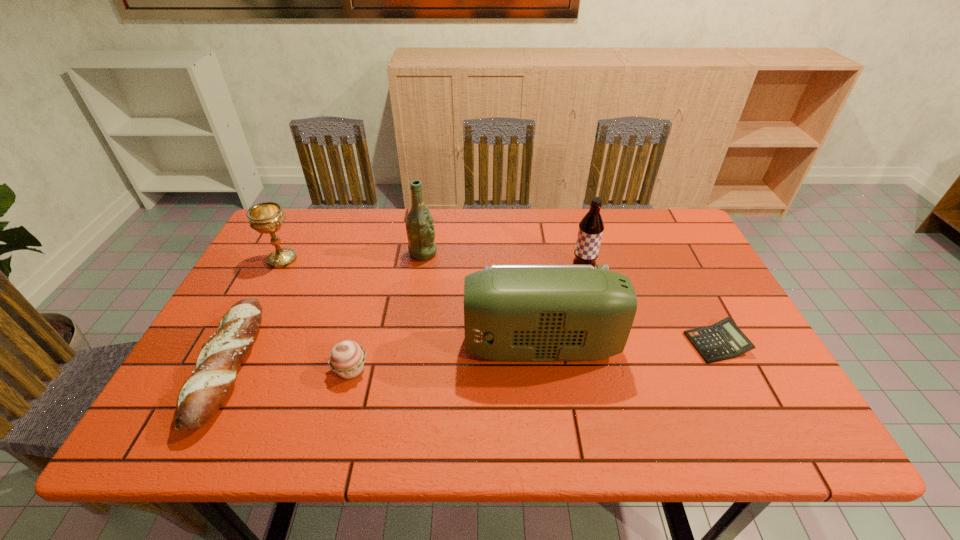
Identify the location of the fourth object from right to left. This screenshot has height=540, width=960. (419, 223).

The width and height of the screenshot is (960, 540). I want to click on root beer, so click(591, 227).

Locate an element on the screen. This screenshot has width=960, height=540. radio_receiver is located at coordinates (511, 312).

Where is `chalice`? The height and width of the screenshot is (540, 960). chalice is located at coordinates (x=267, y=217).

Locate an element on the screen. The width and height of the screenshot is (960, 540). cupcake is located at coordinates (347, 358).

Where is `the fifth tallest object`? The width and height of the screenshot is (960, 540). the fifth tallest object is located at coordinates [x=347, y=358].

The image size is (960, 540). In order to click on baguet in this screenshot , I will do `click(200, 397)`.

Locate an element on the screen. This screenshot has height=540, width=960. the rightmost object is located at coordinates (723, 340).

This screenshot has height=540, width=960. Find the location of `the shortest object`. the shortest object is located at coordinates (723, 340).

Find the location of a particular element. This screenshot has width=960, height=540. free space located 0.230m on the surface of the beer bottle is located at coordinates (514, 253).